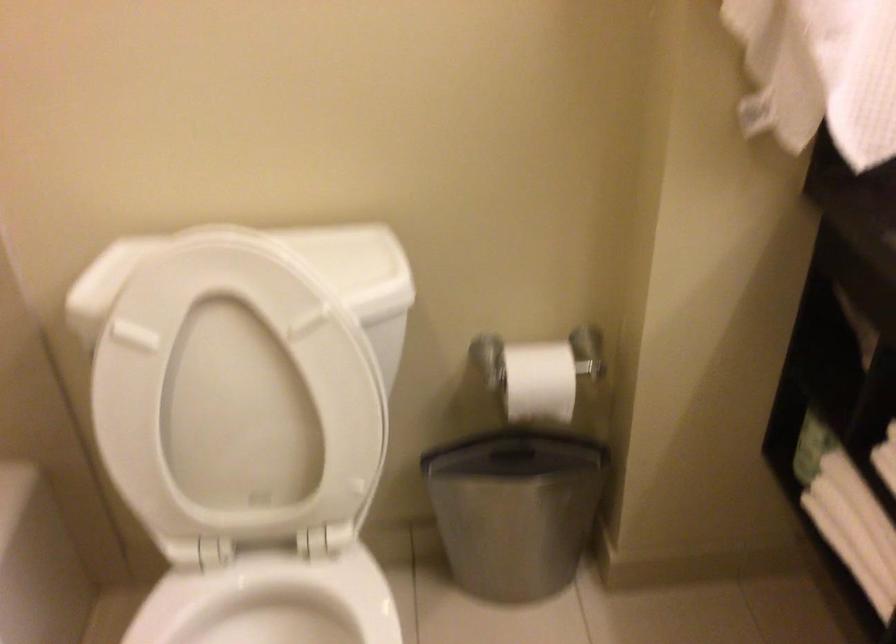
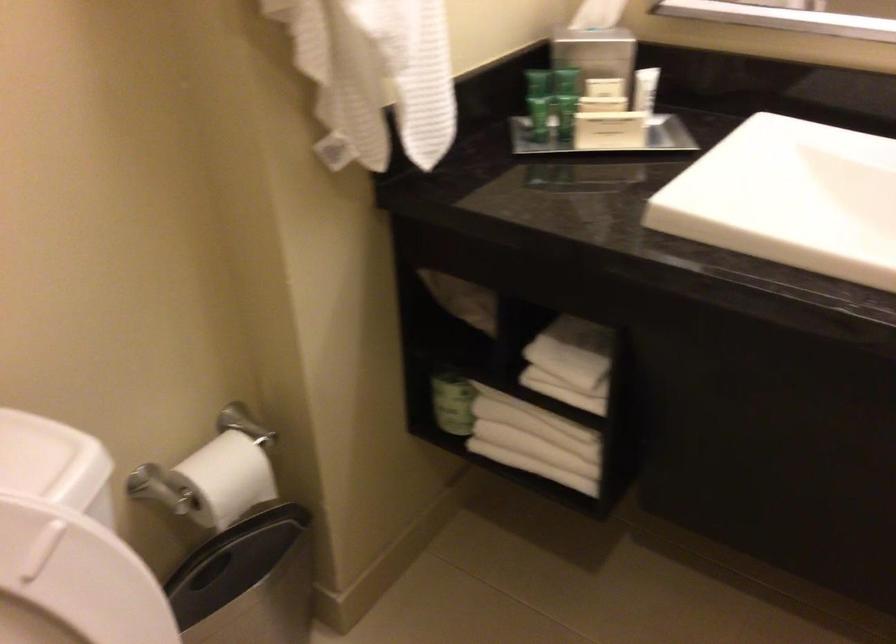
Where in the second image is the point corresponding to (x=519, y=371) from the first image?

(211, 480)